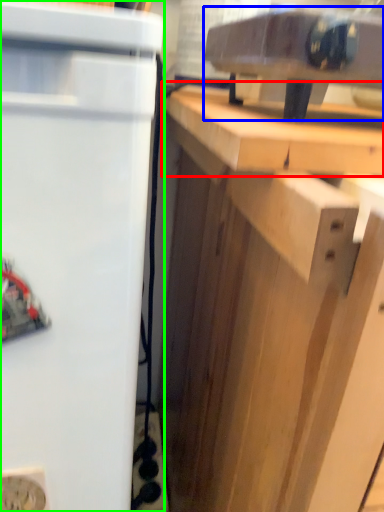
Question: Which is farther away from counter top (highlighted by a red box)? appliance (highlighted by a blue box) or refrigerator (highlighted by a green box)?

Choices:
 (A) appliance
 (B) refrigerator

Answer: (B)